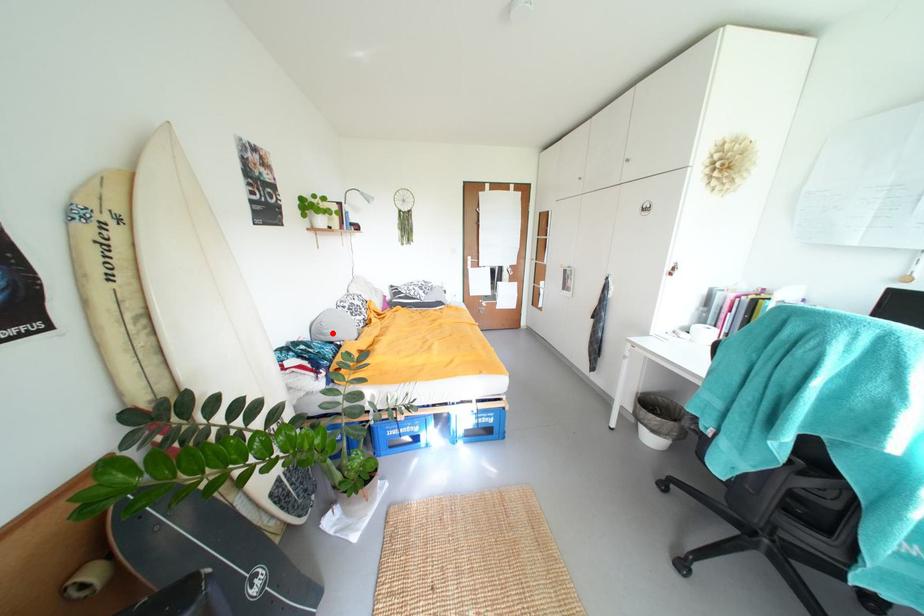
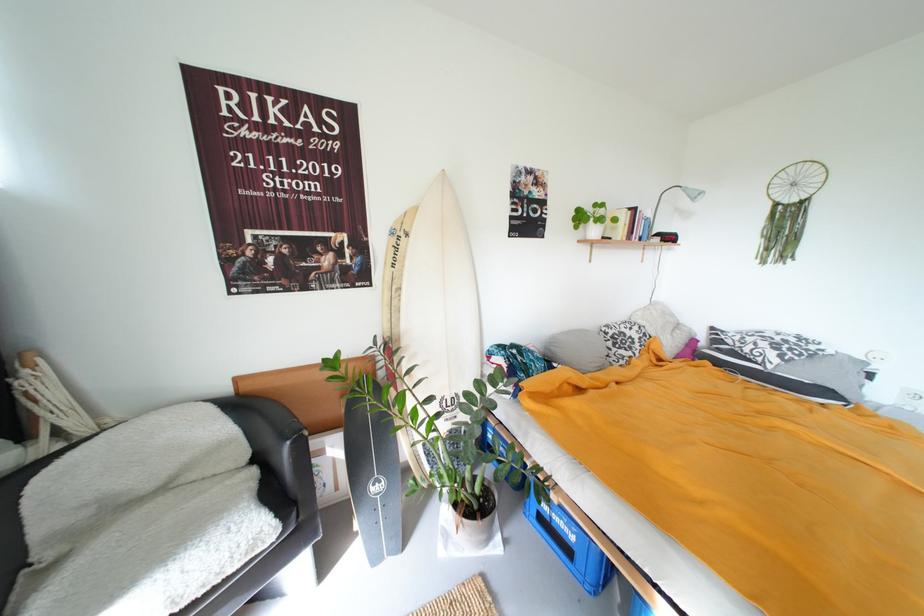
Question: I am providing you with two images of the same scene from different viewpoints. Given a red point in image1, look at the same physical point in image2. Is it:

Choices:
 (A) Closer to the viewpoint
 (B) Farther from the viewpoint

Answer: (B)